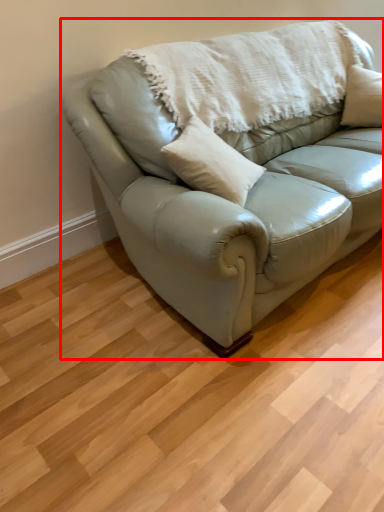
Question: From the image's perspective, what is the correct spatial relationship of studio couch (annotated by the red box) in relation to blanket?

Choices:
 (A) above
 (B) below

Answer: (B)